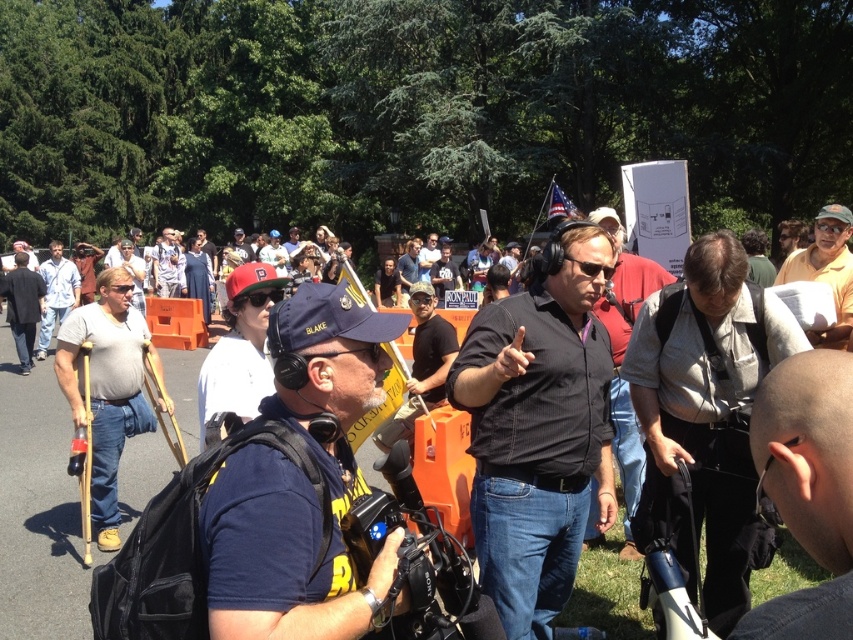
Is black cotton t-shirt at center smaller than matte black shirt at center?

No, black cotton t-shirt at center is not smaller than matte black shirt at center.

Does point (408, 417) come behind point (421, 266)?

No, it is not.

Is point (438, 342) farther from camera compared to point (436, 259)?

No, it is not.

Where is `black cotton t-shirt at center`? The height and width of the screenshot is (640, 853). black cotton t-shirt at center is located at coordinates (422, 365).

Based on the photo, does navy blue shirt at center have a greater height compared to gray fabric shirt at center?

No.

Is point (321, 432) positioned in front of point (720, 452)?

Yes.

Locate an element on the screen. The image size is (853, 640). navy blue shirt at center is located at coordinates (280, 556).

Does navy blue shirt at center have a lesser height compared to green shirt at upper right?

In fact, navy blue shirt at center may be taller than green shirt at upper right.

Which is behind, point (277, 476) or point (770, 273)?

The point (770, 273) is behind.

Who is more forward, [305,296] or [764,241]?

Point [305,296] is more forward.

Locate an element on the screen. navy blue shirt at center is located at coordinates (280, 556).